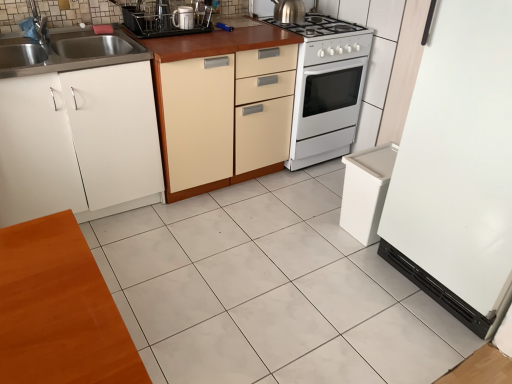
Question: Which direction should I rotate to look at metallic stainless steel dish rack at upper center, the 1th appliance from the top?

Choices:
 (A) right
 (B) left

Answer: (B)

Question: Is white glossy refrigerator at right, positioned as the second appliance in left-to-right order, turned away from white glossy coffee maker at center, the first kitchen appliance when ordered from front to back?

Choices:
 (A) yes
 (B) no

Answer: (B)

Question: Is white glossy coffee maker at center, the first kitchen appliance when ordered from front to back, surrounded by white glossy refrigerator at right, marked as the 2th appliance in a top-to-bottom arrangement?

Choices:
 (A) no
 (B) yes

Answer: (A)

Question: Is white glossy refrigerator at right, positioned as the second appliance in left-to-right order, to the left of white glossy coffee maker at center, the 1th kitchen appliance ordered from the bottom, from the viewer's perspective?

Choices:
 (A) no
 (B) yes

Answer: (A)

Question: Is white glossy refrigerator at right, which is the first appliance from bottom to top, positioned far away from white glossy coffee maker at center, the first kitchen appliance in the left-to-right sequence?

Choices:
 (A) no
 (B) yes

Answer: (B)

Question: From a real-world perspective, is white glossy refrigerator at right, which is the first appliance from bottom to top, located higher than white glossy coffee maker at center, the first kitchen appliance in the left-to-right sequence?

Choices:
 (A) no
 (B) yes

Answer: (A)

Question: Is white glossy refrigerator at right, marked as the 2th appliance in a top-to-bottom arrangement, facing towards white glossy coffee maker at center, which is the second kitchen appliance in back-to-front order?

Choices:
 (A) yes
 (B) no

Answer: (B)

Question: Is the depth of white glossy stove at center less than that of white glossy tile at center?

Choices:
 (A) no
 (B) yes

Answer: (A)

Question: Considering the relative sizes of white glossy stove at center and white glossy tile at center in the image provided, is white glossy stove at center smaller than white glossy tile at center?

Choices:
 (A) no
 (B) yes

Answer: (A)

Question: From the image's perspective, would you say white glossy stove at center is positioned over white glossy tile at center?

Choices:
 (A) no
 (B) yes

Answer: (B)

Question: Is white glossy stove at center facing away from white glossy tile at center?

Choices:
 (A) yes
 (B) no

Answer: (B)

Question: From a real-world perspective, does white glossy stove at center sit lower than white glossy tile at center?

Choices:
 (A) no
 (B) yes

Answer: (A)

Question: Is white glossy stove at center not near white glossy tile at center?

Choices:
 (A) no
 (B) yes

Answer: (A)

Question: From the image's perspective, is polished stainless steel kettle at upper center, arranged as the 2th kitchen appliance when ordered from the bottom, above white matte cabinet at left, which is the 2th cabinetry from right to left?

Choices:
 (A) no
 (B) yes

Answer: (B)